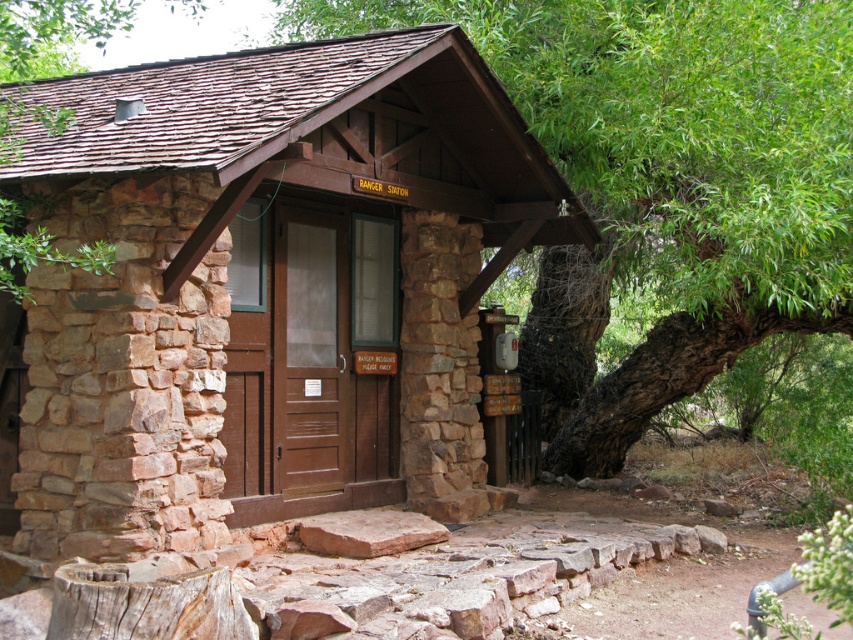
You are standing in front of the Ranger Station and notice the brown stone cabin at center and the green leafy tree at center. Which one is positioned to the left?

The brown stone cabin at center is to the left of the green leafy tree at center, so the brown stone cabin at center is positioned to the left.

You are a park ranger carrying a heavy backpack and need to move from the brown stone cabin at center to the green leafy tree at center. Can you walk directly between them without any obstacles?

The brown stone cabin at center and green leafy tree at center are 2.58 meters apart, so yes, you can walk directly between them as there is enough space.